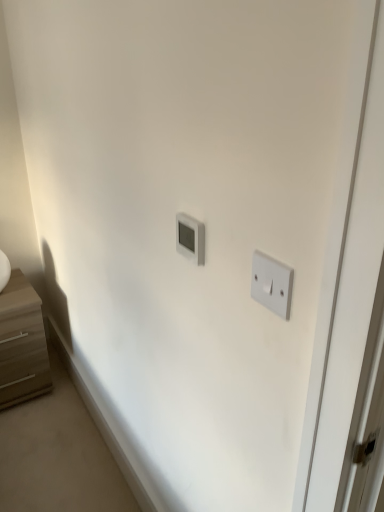
Where is `light brown wood chest of drawers at left`? light brown wood chest of drawers at left is located at coordinates (22, 343).

Does white plastic light switch at right, placed as the 1th light switch when sorted from front to back, appear on the right side of white plastic thermostat at center, the 2th light switch viewed from the front?

Yes.

From a real-world perspective, is white plastic light switch at right, the first light switch when ordered from right to left, positioned under white plastic thermostat at center, acting as the first light switch starting from the left, based on gravity?

Actually, white plastic light switch at right, the first light switch when ordered from right to left, is physically above white plastic thermostat at center, acting as the first light switch starting from the left, in the real world.

Which is in front, white plastic light switch at right, the first light switch when ordered from right to left, or white plastic thermostat at center, arranged as the 2th light switch when viewed from the right?

white plastic light switch at right, the first light switch when ordered from right to left, is closer to the camera.

Are white plastic light switch at right, which appears as the 2th light switch when viewed from the left, and white plastic thermostat at center, the 2th light switch viewed from the front, far apart?

No, there isn't a large distance between white plastic light switch at right, which appears as the 2th light switch when viewed from the left, and white plastic thermostat at center, the 2th light switch viewed from the front.

Can you confirm if white plastic light switch at right, marked as the second light switch in a back-to-front arrangement, is smaller than light brown wood chest of drawers at left?

Yes.

Looking at this image, from a real-world perspective, is white plastic light switch at right, which appears as the 2th light switch when viewed from the left, under light brown wood chest of drawers at left?

No, from a real-world perspective, white plastic light switch at right, which appears as the 2th light switch when viewed from the left, is not below light brown wood chest of drawers at left.

Is white plastic light switch at right, placed as the 1th light switch when sorted from front to back, touching light brown wood chest of drawers at left?

No.

Which is in front, light brown wood chest of drawers at left or white plastic light switch at right, marked as the second light switch in a back-to-front arrangement?

white plastic light switch at right, marked as the second light switch in a back-to-front arrangement, is more forward.

Does light brown wood chest of drawers at left have a lesser height compared to white plastic light switch at right, marked as the second light switch in a back-to-front arrangement?

No, light brown wood chest of drawers at left is not shorter than white plastic light switch at right, marked as the second light switch in a back-to-front arrangement.

Is light brown wood chest of drawers at left inside the boundaries of white plastic light switch at right, which appears as the 2th light switch when viewed from the left, or outside?

light brown wood chest of drawers at left is not inside white plastic light switch at right, which appears as the 2th light switch when viewed from the left, it's outside.

Locate an element on the screen. The width and height of the screenshot is (384, 512). light switch that is the 1st one when counting upward from the light brown wood chest of drawers at left (from the image's perspective) is located at coordinates (272, 284).

From the image's perspective, is white plastic thermostat at center, the 2th light switch viewed from the front, under light brown wood chest of drawers at left?

Actually, white plastic thermostat at center, the 2th light switch viewed from the front, appears above light brown wood chest of drawers at left in the image.

Is point (178, 229) in front of point (12, 387)?

Yes, point (178, 229) is in front of point (12, 387).

Are white plastic thermostat at center, acting as the first light switch starting from the left, and light brown wood chest of drawers at left located far from each other?

Yes.

The height and width of the screenshot is (512, 384). In order to click on light switch located underneath the white plastic light switch at right, marked as the second light switch in a back-to-front arrangement (from a real-world perspective) in this screenshot , I will do `click(190, 237)`.

Is white plastic thermostat at center, arranged as the 2th light switch when viewed from the right, taller than white plastic light switch at right, placed as the 1th light switch when sorted from front to back?

No, white plastic thermostat at center, arranged as the 2th light switch when viewed from the right, is not taller than white plastic light switch at right, placed as the 1th light switch when sorted from front to back.

Consider the image. From a real-world perspective, which is physically above, white plastic thermostat at center, arranged as the 2th light switch when viewed from the right, or white plastic light switch at right, placed as the 1th light switch when sorted from front to back?

white plastic light switch at right, placed as the 1th light switch when sorted from front to back, from a real-world perspective.

Does point (204, 261) come in front of point (255, 296)?

That is False.

From the image's perspective, who appears lower, light brown wood chest of drawers at left or white plastic thermostat at center, the 2th light switch viewed from the front?

light brown wood chest of drawers at left appears lower in the image.

Is light brown wood chest of drawers at left inside or outside of white plastic thermostat at center, acting as the first light switch starting from the left?

light brown wood chest of drawers at left is spatially situated outside white plastic thermostat at center, acting as the first light switch starting from the left.

Looking at their sizes, would you say light brown wood chest of drawers at left is wider or thinner than white plastic thermostat at center, which is the first light switch from back to front?

light brown wood chest of drawers at left is wider than white plastic thermostat at center, which is the first light switch from back to front.

Does point (18, 301) lie in front of point (202, 224)?

That is False.

Where is `light switch on the left of white plastic light switch at right, marked as the second light switch in a back-to-front arrangement`? The height and width of the screenshot is (512, 384). light switch on the left of white plastic light switch at right, marked as the second light switch in a back-to-front arrangement is located at coordinates (190, 237).

You are a GUI agent. You are given a task and a screenshot of the screen. Output one action in this format:
    pyautogui.click(x=<x>, y=<y>)
    Task: Click on the chest of drawers below the white plastic light switch at right, placed as the 1th light switch when sorted from front to back (from the image's perspective)
    
    Given the screenshot: What is the action you would take?
    pyautogui.click(x=22, y=343)

Estimate the real-world distances between objects in this image. Which object is closer to white plastic light switch at right, marked as the second light switch in a back-to-front arrangement, white plastic thermostat at center, arranged as the 2th light switch when viewed from the right, or light brown wood chest of drawers at left?

Based on the image, white plastic thermostat at center, arranged as the 2th light switch when viewed from the right, appears to be nearer to white plastic light switch at right, marked as the second light switch in a back-to-front arrangement.

Looking at the image, which one is located further to white plastic light switch at right, which appears as the 2th light switch when viewed from the left, light brown wood chest of drawers at left or white plastic thermostat at center, acting as the first light switch starting from the left?

Based on the image, light brown wood chest of drawers at left appears to be further to white plastic light switch at right, which appears as the 2th light switch when viewed from the left.

Estimate the real-world distances between objects in this image. Which object is further from light brown wood chest of drawers at left, white plastic light switch at right, placed as the 1th light switch when sorted from front to back, or white plastic thermostat at center, arranged as the 2th light switch when viewed from the right?

white plastic light switch at right, placed as the 1th light switch when sorted from front to back, lies further to light brown wood chest of drawers at left than the other object.

Which object lies further to the anchor point white plastic thermostat at center, the 2th light switch viewed from the front, light brown wood chest of drawers at left or white plastic light switch at right, the first light switch when ordered from right to left?

Among the two, light brown wood chest of drawers at left is located further to white plastic thermostat at center, the 2th light switch viewed from the front.

Based on their spatial positions, is white plastic light switch at right, the first light switch when ordered from right to left, or light brown wood chest of drawers at left further from white plastic thermostat at center, arranged as the 2th light switch when viewed from the right?

light brown wood chest of drawers at left lies further to white plastic thermostat at center, arranged as the 2th light switch when viewed from the right, than the other object.

Which object lies further to the anchor point light brown wood chest of drawers at left, white plastic thermostat at center, acting as the first light switch starting from the left, or white plastic light switch at right, marked as the second light switch in a back-to-front arrangement?

The object further to light brown wood chest of drawers at left is white plastic light switch at right, marked as the second light switch in a back-to-front arrangement.

Find the location of a particular element. This screenshot has width=384, height=512. light switch between white plastic light switch at right, the first light switch when ordered from right to left, and light brown wood chest of drawers at left in the front-back direction is located at coordinates (190, 237).